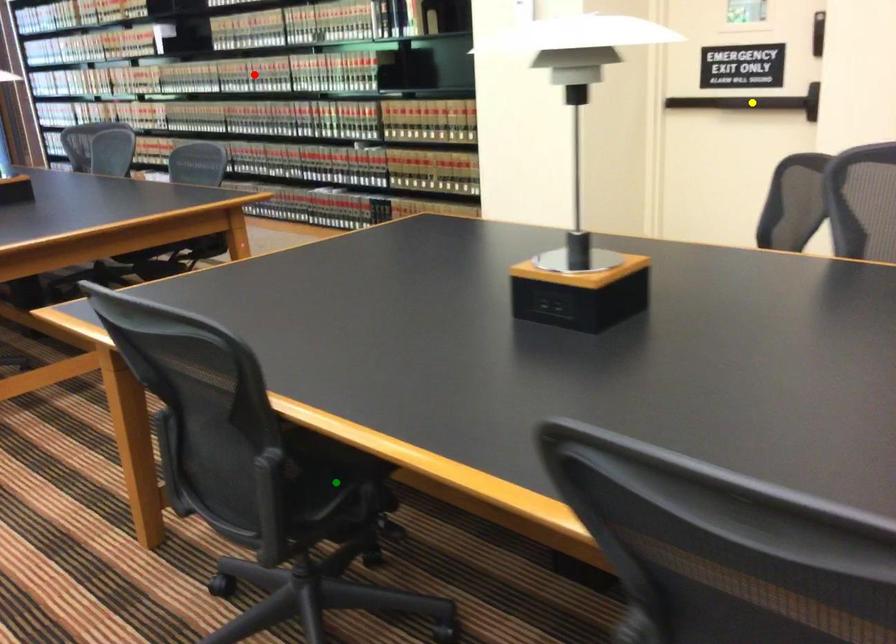
Order these from farthest to nearest:
- yellow point
- red point
- green point

red point
yellow point
green point